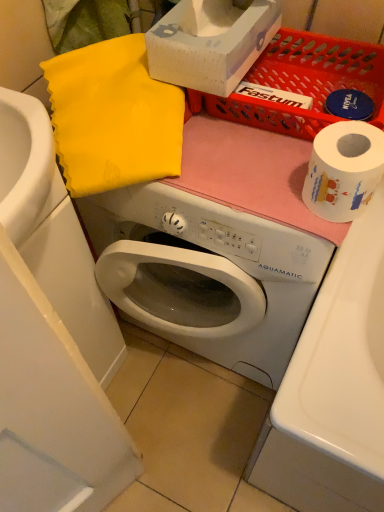
Question: Considering the relative sizes of white cardboard box at upper center and white glossy sink at lower left in the image provided, is white cardboard box at upper center taller than white glossy sink at lower left?

Choices:
 (A) no
 (B) yes

Answer: (A)

Question: Is white cardboard box at upper center not close to white glossy sink at lower left?

Choices:
 (A) no
 (B) yes

Answer: (A)

Question: Can you confirm if white cardboard box at upper center is smaller than white glossy sink at lower left?

Choices:
 (A) yes
 (B) no

Answer: (A)

Question: Is white cardboard box at upper center not inside white glossy sink at lower left?

Choices:
 (A) no
 (B) yes

Answer: (B)

Question: From a real-world perspective, is white cardboard box at upper center positioned over white glossy sink at lower left based on gravity?

Choices:
 (A) yes
 (B) no

Answer: (A)

Question: Is white cardboard box at upper center at the left side of white glossy sink at lower left?

Choices:
 (A) yes
 (B) no

Answer: (B)

Question: Is white paper at right closer to the viewer compared to white glossy sink at lower left?

Choices:
 (A) no
 (B) yes

Answer: (B)

Question: Can you confirm if white paper at right is shorter than white glossy sink at lower left?

Choices:
 (A) yes
 (B) no

Answer: (A)

Question: From the image's perspective, is white paper at right over white glossy sink at lower left?

Choices:
 (A) no
 (B) yes

Answer: (B)

Question: Can you confirm if white paper at right is taller than white glossy sink at lower left?

Choices:
 (A) no
 (B) yes

Answer: (A)

Question: Is the depth of white paper at right greater than that of white glossy sink at lower left?

Choices:
 (A) no
 (B) yes

Answer: (A)

Question: Is white paper at right not close to white glossy sink at lower left?

Choices:
 (A) yes
 (B) no

Answer: (B)

Question: Does white paper at right have a greater height compared to white cardboard box at upper center?

Choices:
 (A) no
 (B) yes

Answer: (A)